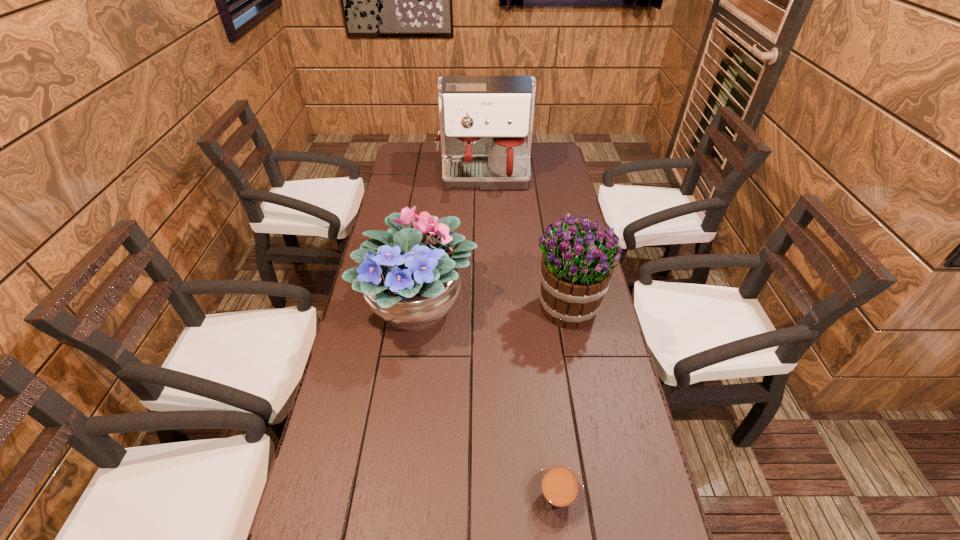
The image size is (960, 540). Identify the location of vacant region between the farthest object and the cappuccino. (520, 336).

Image resolution: width=960 pixels, height=540 pixels. Identify the location of free space between the left bouquet and the right bouquet. 492,306.

Where is `free area in between the left bouquet and the right bouquet`? This screenshot has width=960, height=540. free area in between the left bouquet and the right bouquet is located at coordinates (492, 306).

Locate an element on the screen. The width and height of the screenshot is (960, 540). empty location between the left bouquet and the shortest object is located at coordinates (488, 401).

Where is `free space between the right bouquet and the left bouquet`? The height and width of the screenshot is (540, 960). free space between the right bouquet and the left bouquet is located at coordinates (492, 306).

The width and height of the screenshot is (960, 540). In order to click on vacant area between the farthest object and the cappuccino in this screenshot , I will do `click(520, 336)`.

The height and width of the screenshot is (540, 960). Identify the location of the second closest object relative to the farthest object. (576, 269).

Locate which object ranks second in proximity to the shortest object. Please provide its 2D coordinates. Your answer should be formatted as a tuple, i.e. [(x, y)], where the tuple contains the x and y coordinates of a point satisfying the conditions above.

[(576, 269)]

You are a GUI agent. You are given a task and a screenshot of the screen. Output one action in this format:
    pyautogui.click(x=<x>, y=<y>)
    Task: Click on the free space that satisfies the following two spatial constraints: 1. on the front of the right bouquet near the spout; 2. on the left side of the farthest object
    
    Given the screenshot: What is the action you would take?
    pyautogui.click(x=486, y=307)

Image resolution: width=960 pixels, height=540 pixels. I want to click on free space that satisfies the following two spatial constraints: 1. on the front of the coffee maker near the spout; 2. on the left side of the right bouquet, so click(x=486, y=307).